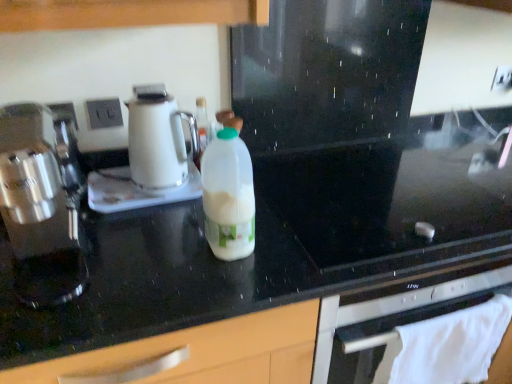
Image resolution: width=512 pixels, height=384 pixels. What are the coordinates of `free space in front of white glossy kettle at center` in the screenshot? It's located at (159, 236).